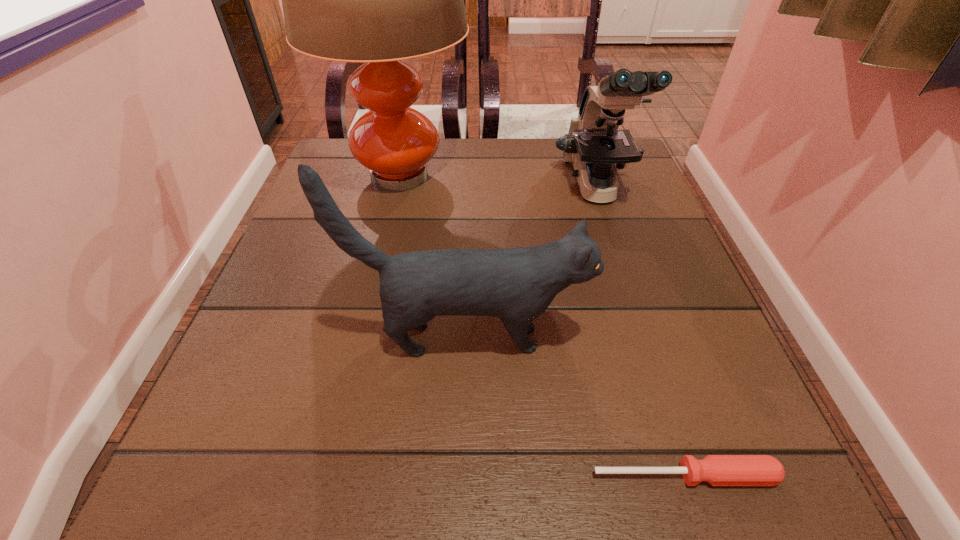
Where is `microscope that is positioned at the far edge`? The width and height of the screenshot is (960, 540). microscope that is positioned at the far edge is located at coordinates (594, 144).

You are a GUI agent. You are given a task and a screenshot of the screen. Output one action in this format:
    pyautogui.click(x=<x>, y=<y>)
    Task: Click on the object present at the near edge
    
    Given the screenshot: What is the action you would take?
    pyautogui.click(x=718, y=470)

This screenshot has width=960, height=540. In order to click on object at the left edge in this screenshot , I will do `click(377, 0)`.

Image resolution: width=960 pixels, height=540 pixels. I want to click on microscope situated at the right edge, so click(x=594, y=144).

Find the location of a particular element. The width and height of the screenshot is (960, 540). screwdriver positioned at the right edge is located at coordinates (718, 470).

This screenshot has width=960, height=540. Find the location of `object present at the far left corner`. object present at the far left corner is located at coordinates (377, 0).

You are a GUI agent. You are given a task and a screenshot of the screen. Output one action in this format:
    pyautogui.click(x=<x>, y=<y>)
    Task: Click on the object present at the far right corner
    This screenshot has width=960, height=540.
    Given the screenshot: What is the action you would take?
    pyautogui.click(x=594, y=144)

Locate an element on the screen. Image resolution: width=960 pixels, height=540 pixels. object at the near right corner is located at coordinates (718, 470).

You are a GUI agent. You are given a task and a screenshot of the screen. Output one action in this format:
    pyautogui.click(x=<x>, y=<y>)
    Task: Click on the vacant space at the far edge of the desktop
    The height and width of the screenshot is (540, 960).
    Given the screenshot: What is the action you would take?
    pyautogui.click(x=425, y=186)

In the image, there is a desktop. Identify the location of free space at the left edge. [238, 339].